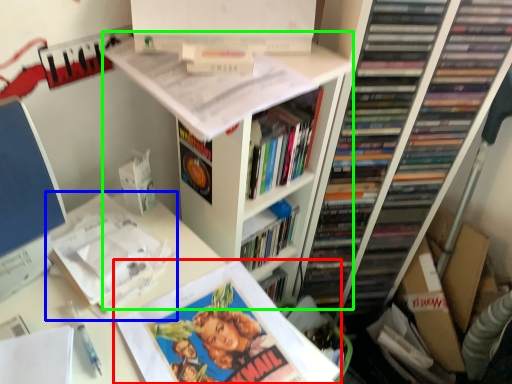
Question: Which is farther away from book (highlighted by a red box)? book (highlighted by a blue box) or bookshelf (highlighted by a green box)?

Choices:
 (A) book
 (B) bookshelf

Answer: (B)